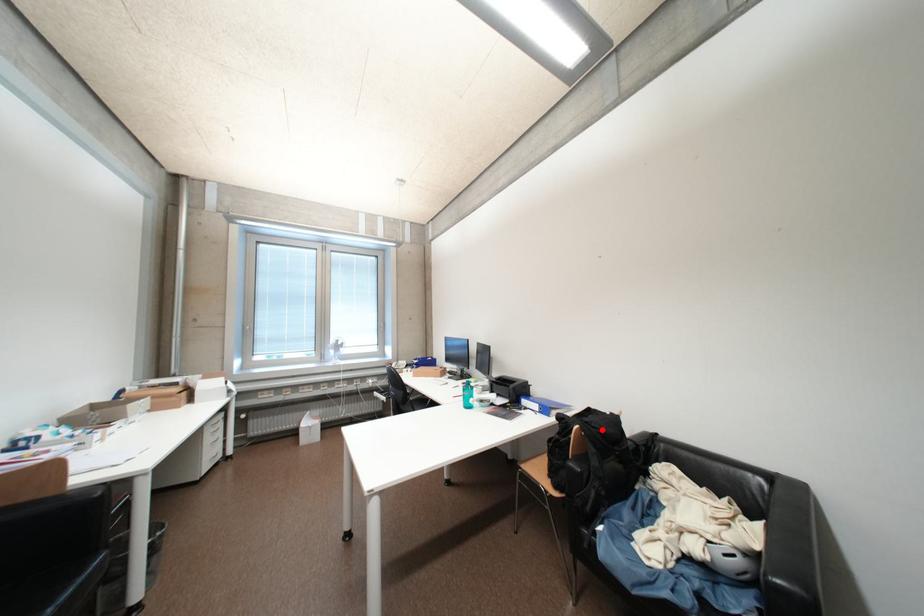
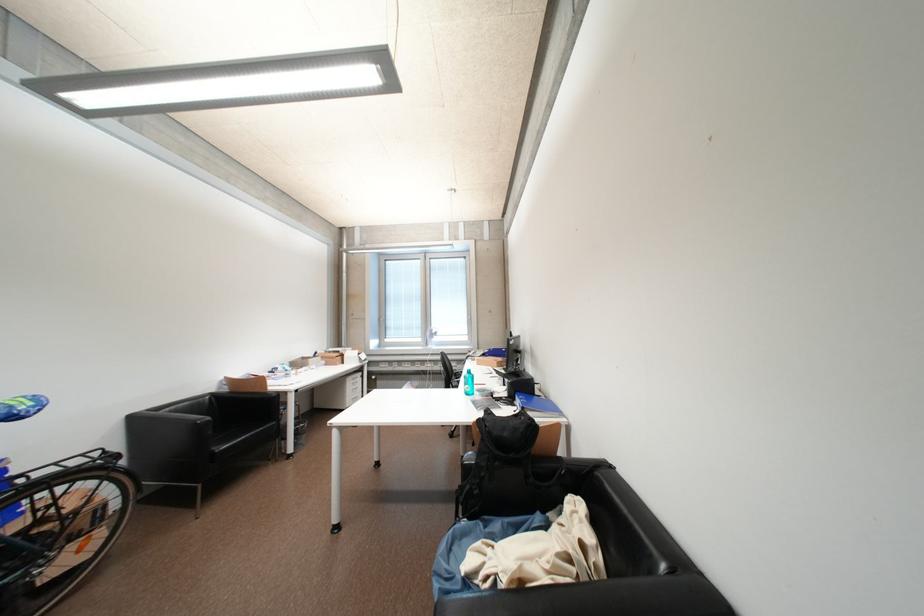
Question: I am providing you with two images of the same scene from different viewpoints. Given a red point in image1, look at the same physical point in image2. Is it:

Choices:
 (A) Closer to the viewpoint
 (B) Farther from the viewpoint

Answer: (A)